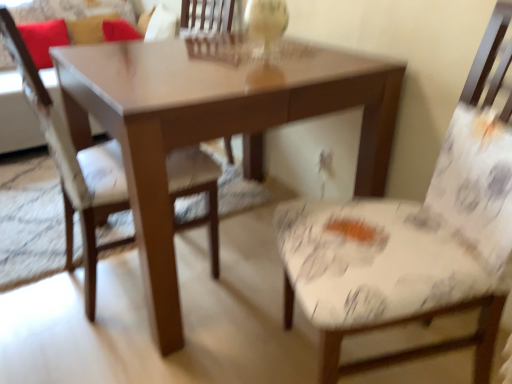
Question: Is velvet red pillow at upper left, which is the second pillow from left to right, thinner than patterned fabric chair at left, the 2th chair viewed from the right?

Choices:
 (A) yes
 (B) no

Answer: (A)

Question: Is velvet red pillow at upper left, which is the second pillow from left to right, facing towards patterned fabric chair at left, marked as the 1th chair in a left-to-right arrangement?

Choices:
 (A) no
 (B) yes

Answer: (B)

Question: Is velvet red pillow at upper left, which is the second pillow from left to right, positioned far away from patterned fabric chair at left, the 2th chair viewed from the right?

Choices:
 (A) no
 (B) yes

Answer: (B)

Question: Considering the relative positions of velvet red pillow at upper left, which is the second pillow from left to right, and patterned fabric chair at left, marked as the 1th chair in a left-to-right arrangement, in the image provided, is velvet red pillow at upper left, which is the second pillow from left to right, to the left of patterned fabric chair at left, marked as the 1th chair in a left-to-right arrangement, from the viewer's perspective?

Choices:
 (A) no
 (B) yes

Answer: (B)

Question: Considering the relative positions of velvet red pillow at upper left, which is the second pillow from left to right, and patterned fabric chair at left, the 2th chair viewed from the right, in the image provided, is velvet red pillow at upper left, which is the second pillow from left to right, in front of patterned fabric chair at left, the 2th chair viewed from the right,?

Choices:
 (A) no
 (B) yes

Answer: (A)

Question: Is velvet red pillow at upper left, which is the second pillow from left to right, positioned beyond the bounds of patterned fabric chair at left, the 2th chair viewed from the right?

Choices:
 (A) yes
 (B) no

Answer: (A)

Question: Can you confirm if red fabric pillow at upper left, which ranks as the 1th pillow in left-to-right order, is smaller than patterned fabric chair at left, the 2th chair viewed from the right?

Choices:
 (A) no
 (B) yes

Answer: (B)

Question: Considering the relative positions of red fabric pillow at upper left, which is counted as the second pillow, starting from the right, and patterned fabric chair at left, marked as the 1th chair in a left-to-right arrangement, in the image provided, is red fabric pillow at upper left, which is counted as the second pillow, starting from the right, to the right of patterned fabric chair at left, marked as the 1th chair in a left-to-right arrangement, from the viewer's perspective?

Choices:
 (A) yes
 (B) no

Answer: (B)

Question: From a real-world perspective, is red fabric pillow at upper left, which is counted as the second pillow, starting from the right, physically above patterned fabric chair at left, the 2th chair viewed from the right?

Choices:
 (A) yes
 (B) no

Answer: (A)

Question: Considering the relative sizes of red fabric pillow at upper left, which is counted as the second pillow, starting from the right, and patterned fabric chair at left, the 2th chair viewed from the right, in the image provided, is red fabric pillow at upper left, which is counted as the second pillow, starting from the right, taller than patterned fabric chair at left, the 2th chair viewed from the right,?

Choices:
 (A) no
 (B) yes

Answer: (A)

Question: Could you tell me if red fabric pillow at upper left, which is counted as the second pillow, starting from the right, is turned towards patterned fabric chair at left, marked as the 1th chair in a left-to-right arrangement?

Choices:
 (A) yes
 (B) no

Answer: (A)

Question: Does red fabric pillow at upper left, which is counted as the second pillow, starting from the right, come behind patterned fabric chair at left, the 2th chair viewed from the right?

Choices:
 (A) no
 (B) yes

Answer: (B)

Question: Does matte brown table at center appear on the right side of velvet red couch at upper left?

Choices:
 (A) yes
 (B) no

Answer: (A)